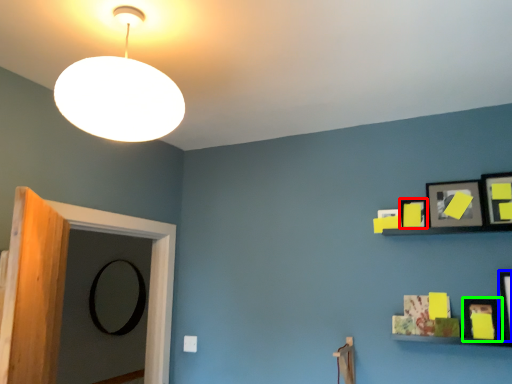
Question: Based on their relative distances, which object is farther from picture frame (highlighted by a red box)? Choose from picture frame (highlighted by a blue box) and picture frame (highlighted by a green box).

Choices:
 (A) picture frame
 (B) picture frame

Answer: (A)